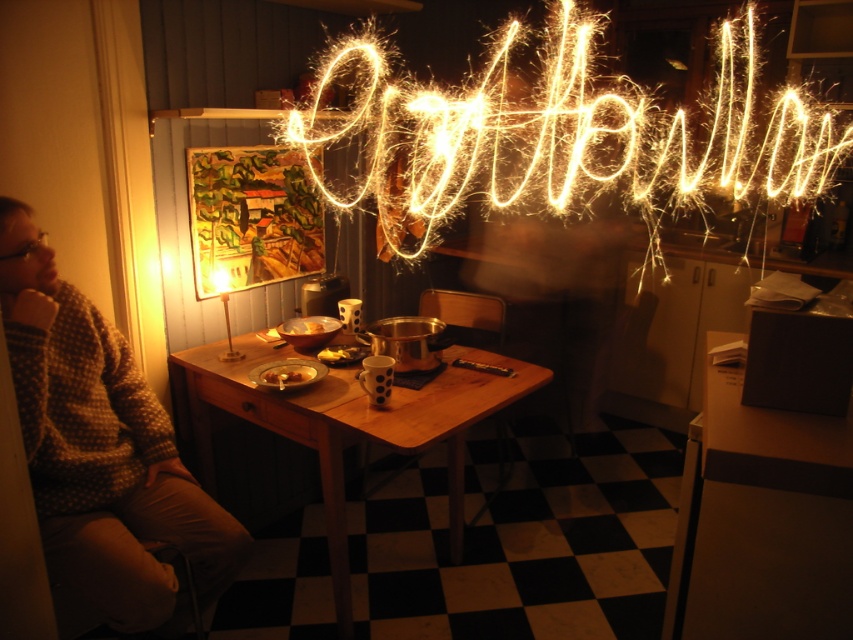
Is knitted sweater at left bigger than smooth brown bread at table center?

Indeed, knitted sweater at left has a larger size compared to smooth brown bread at table center.

The image size is (853, 640). What do you see at coordinates (102, 448) in the screenshot?
I see `knitted sweater at left` at bounding box center [102, 448].

Identify the location of knitted sweater at left. This screenshot has width=853, height=640. (102, 448).

Which is more to the right, knitted sweater at left or wooden table at center?

Positioned to the right is wooden table at center.

Is point (74, 502) positioned behind point (405, 412)?

No.

Does point (27, 342) come behind point (341, 496)?

That is False.

Find the location of a particular element. The image size is (853, 640). knitted sweater at left is located at coordinates (102, 448).

Who is taller, sparkling neon sign at upper center or smooth brown bread at table center?

Standing taller between the two is sparkling neon sign at upper center.

Who is positioned more to the left, sparkling neon sign at upper center or smooth brown bread at table center?

From the viewer's perspective, smooth brown bread at table center appears more on the left side.

Who is more forward, [592,61] or [268,378]?

→ Positioned in front is point [268,378].

Find the location of a particular element. sparkling neon sign at upper center is located at coordinates (560, 132).